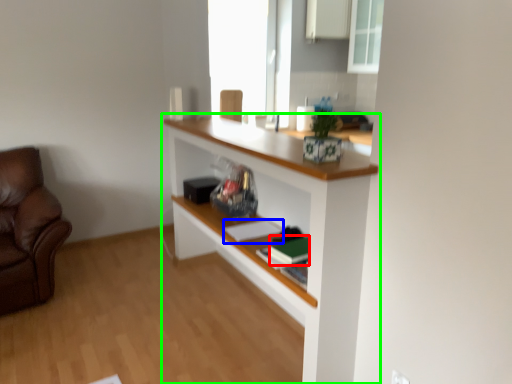
Question: Which is farther away from book (highlighted by a red box)? book (highlighted by a blue box) or shelf (highlighted by a green box)?

Choices:
 (A) book
 (B) shelf

Answer: (B)